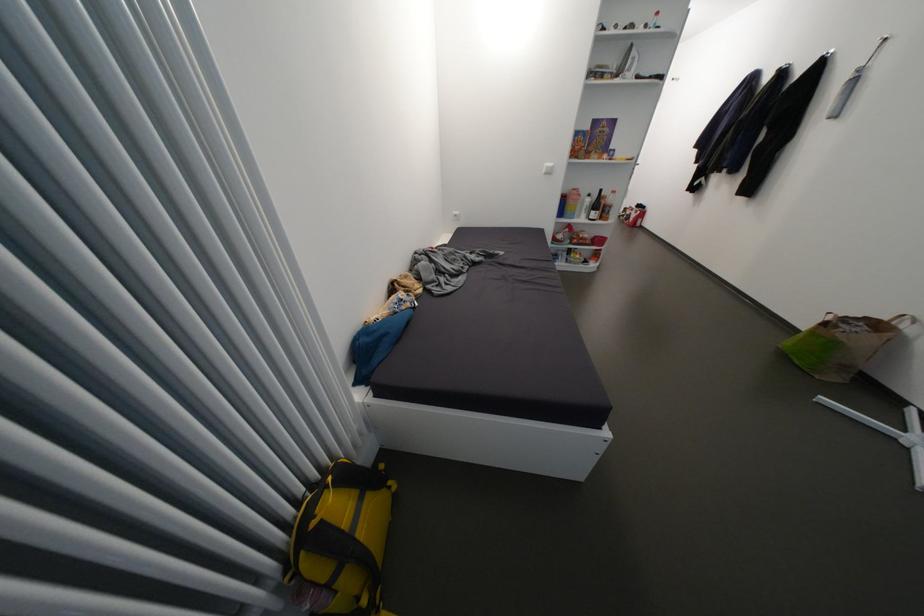
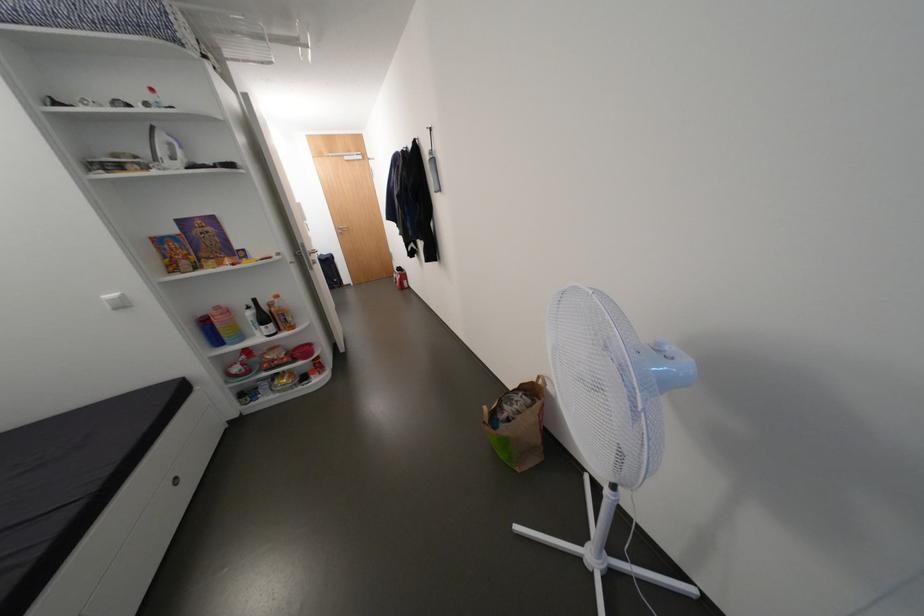
Find the pixel in the second image that matches (x=610, y=203) in the first image.

(281, 310)